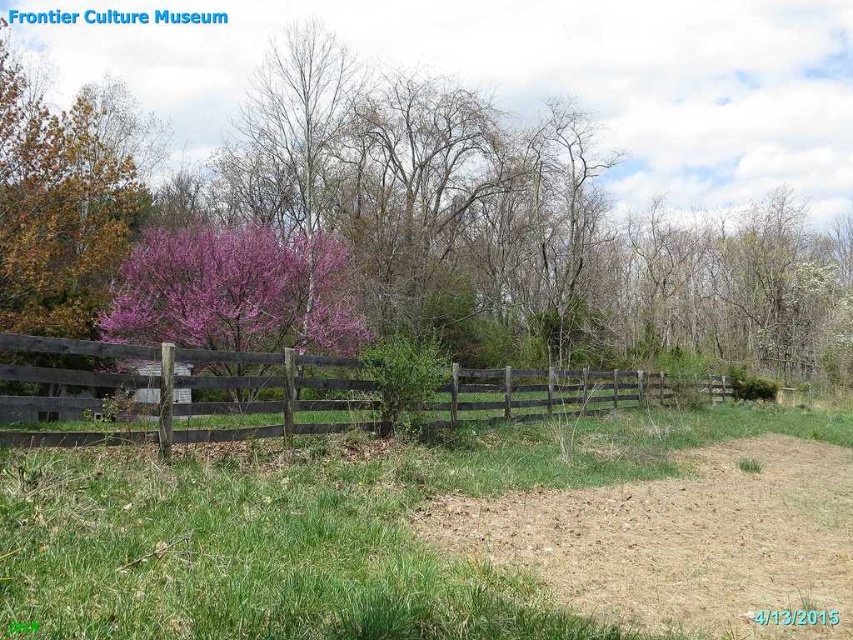
Question: Which is nearer to the brown dirt track at lower right?

Choices:
 (A) purple bloom at center
 (B) brown wooden fence at left
 (C) purple bloom tree at center

Answer: (B)

Question: Is the position of brown dirt track at lower right more distant than that of purple bloom tree at center?

Choices:
 (A) yes
 (B) no

Answer: (B)

Question: Considering the relative positions of purple bloom at center and brown dirt track at lower right in the image provided, where is purple bloom at center located with respect to brown dirt track at lower right?

Choices:
 (A) above
 (B) below

Answer: (A)

Question: Can you confirm if brown wooden fence at left is positioned to the left of purple bloom tree at center?

Choices:
 (A) yes
 (B) no

Answer: (B)

Question: Which point appears closest to the camera in this image?

Choices:
 (A) (206, 193)
 (B) (337, 291)
 (C) (730, 490)
 (D) (289, 416)

Answer: (C)

Question: Estimate the real-world distances between objects in this image. Which object is farther from the purple bloom tree at center?

Choices:
 (A) brown dirt track at lower right
 (B) purple bloom at center
 (C) brown wooden fence at left

Answer: (B)